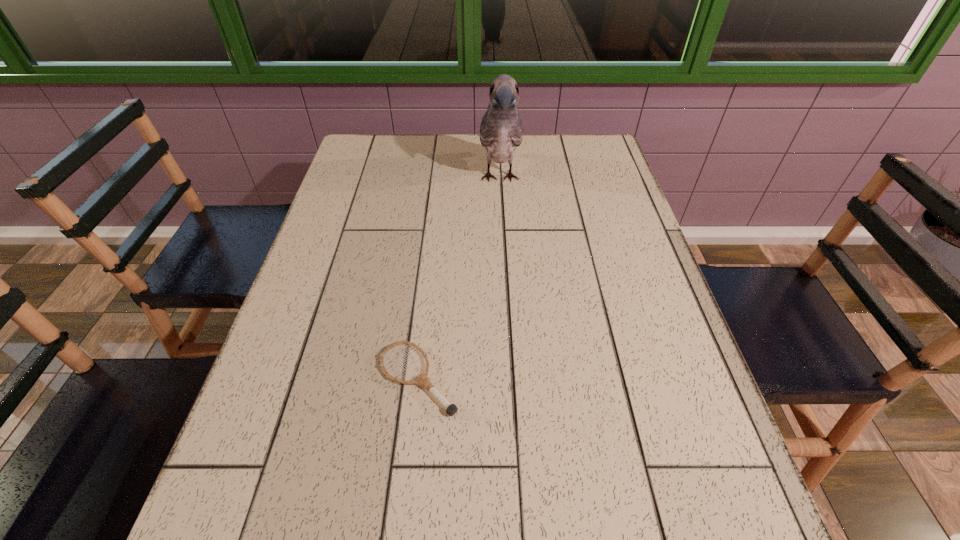
Locate an element on the screen. the farther object is located at coordinates (501, 131).

The width and height of the screenshot is (960, 540). Find the location of `the right object`. the right object is located at coordinates (501, 131).

Locate an element on the screen. The width and height of the screenshot is (960, 540). the left object is located at coordinates (451, 409).

Locate an element on the screen. The width and height of the screenshot is (960, 540). the nearer object is located at coordinates (451, 409).

I want to click on vacant space located on the front-facing side of the taller object, so click(x=504, y=265).

Where is `free location located on the left of the nearer object`? The width and height of the screenshot is (960, 540). free location located on the left of the nearer object is located at coordinates (291, 379).

At what (x,y) coordinates should I click in order to perform the action: click on object that is at the far edge. Please return your answer as a coordinate pair (x, y). The height and width of the screenshot is (540, 960). Looking at the image, I should click on (501, 131).

Locate an element on the screen. This screenshot has height=540, width=960. free space at the far edge of the desktop is located at coordinates (466, 162).

Identify the location of blank space at the left edge. (340, 193).

You are a GUI agent. You are given a task and a screenshot of the screen. Output one action in this format:
    pyautogui.click(x=<x>, y=<y>)
    Task: Click on the vacant area at the right edge of the desktop
    The image size is (960, 540).
    Given the screenshot: What is the action you would take?
    pyautogui.click(x=611, y=287)